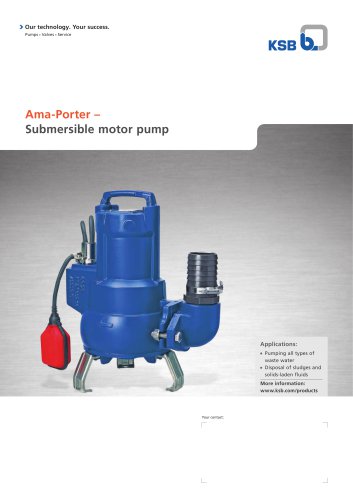
The image size is (353, 500). Identify the location of cable. (56, 285).